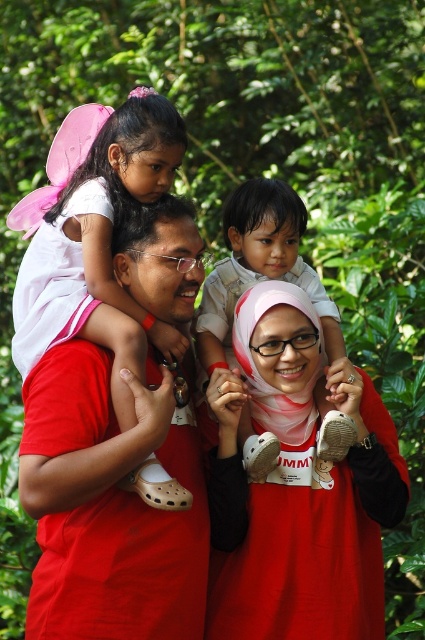
Who is positioned more to the right, matte red hijab at center or light beige cotton shirt at center?

matte red hijab at center is more to the right.

Does matte red hijab at center appear over light beige cotton shirt at center?

Actually, matte red hijab at center is below light beige cotton shirt at center.

Where is `matte red hijab at center`? Image resolution: width=425 pixels, height=640 pixels. matte red hijab at center is located at coordinates (306, 490).

The image size is (425, 640). In order to click on matte red hijab at center in this screenshot , I will do `click(306, 490)`.

Who is positioned more to the left, pink fabric wings at upper left or light beige cotton shirt at center?

From the viewer's perspective, pink fabric wings at upper left appears more on the left side.

You are a GUI agent. You are given a task and a screenshot of the screen. Output one action in this format:
    pyautogui.click(x=<x>, y=<y>)
    Task: Click on the pink fabric wings at upper left
    
    Given the screenshot: What is the action you would take?
    pyautogui.click(x=93, y=237)

How much distance is there between matte red hijab at center and pink fabric wings at upper left?

matte red hijab at center and pink fabric wings at upper left are 3.38 feet apart.

Is point (274, 552) farther from viewer compared to point (121, 172)?

That is False.

Is point (305, 577) behind point (51, 264)?

No, it is not.

This screenshot has width=425, height=640. I want to click on matte red hijab at center, so coord(306,490).